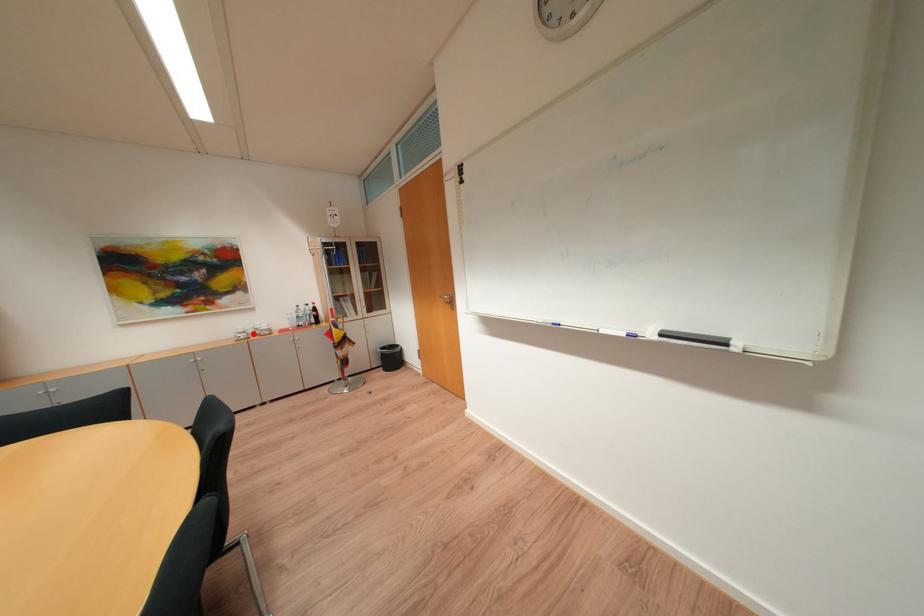
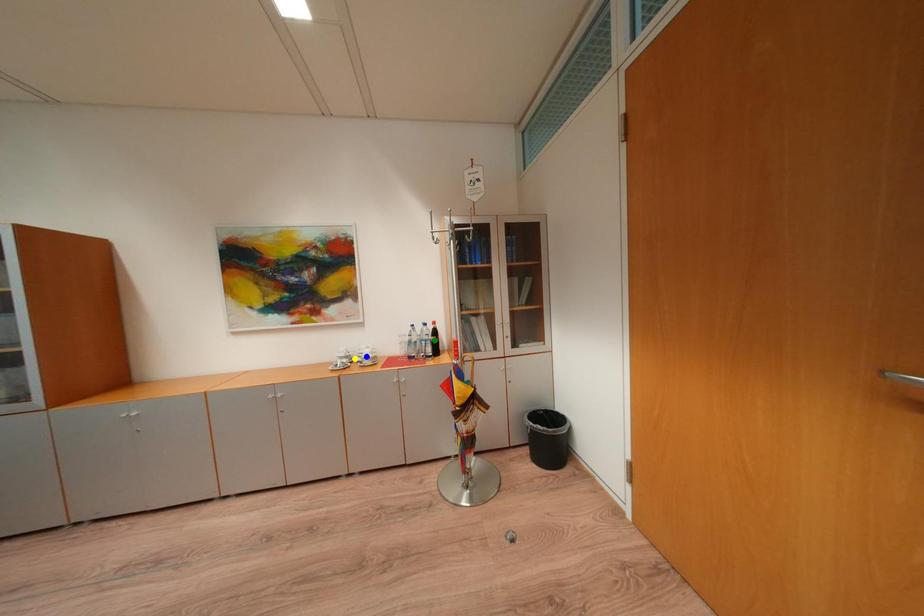
Question: I am providing you with two images of the same scene from different viewpoints. A red point is marked on the first image. You are given multiple points on the second image. Which point in image 2 represents the same 3d spot as the red point in image 1?

Choices:
 (A) green point
 (B) yellow point
 (C) blue point

Answer: (B)